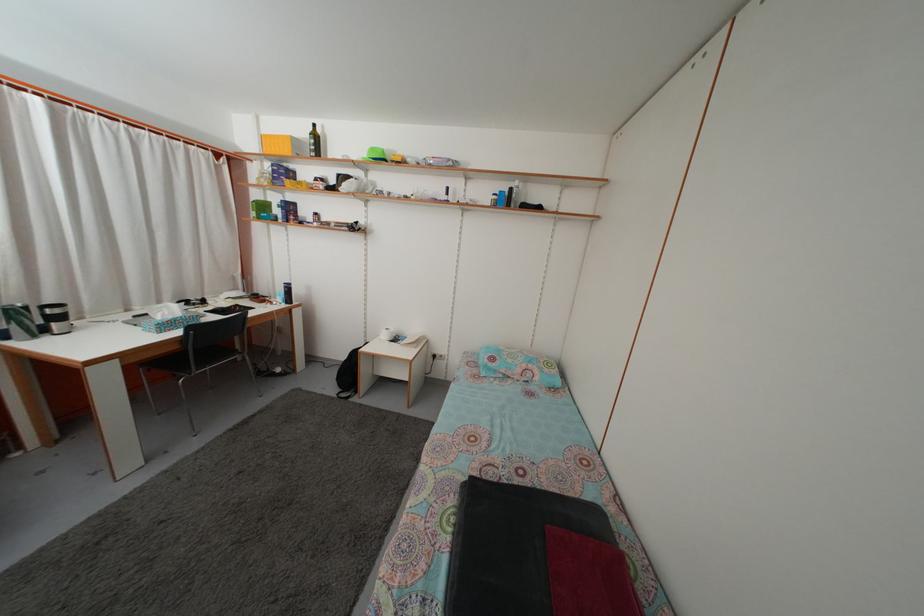
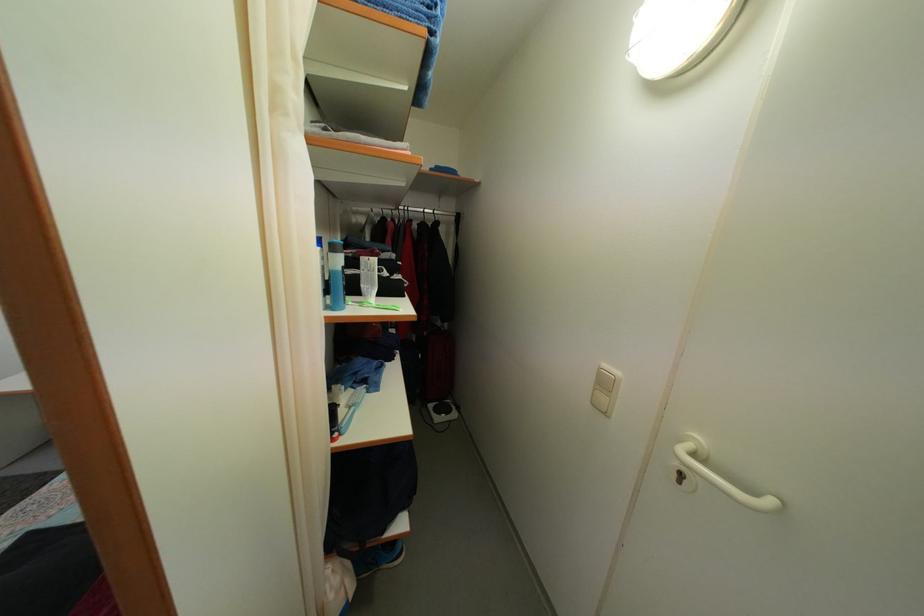
Question: What movement of the cameraman would produce the second image?

Choices:
 (A) Left
 (B) Right
 (C) Forward
 (D) Backward

Answer: (B)